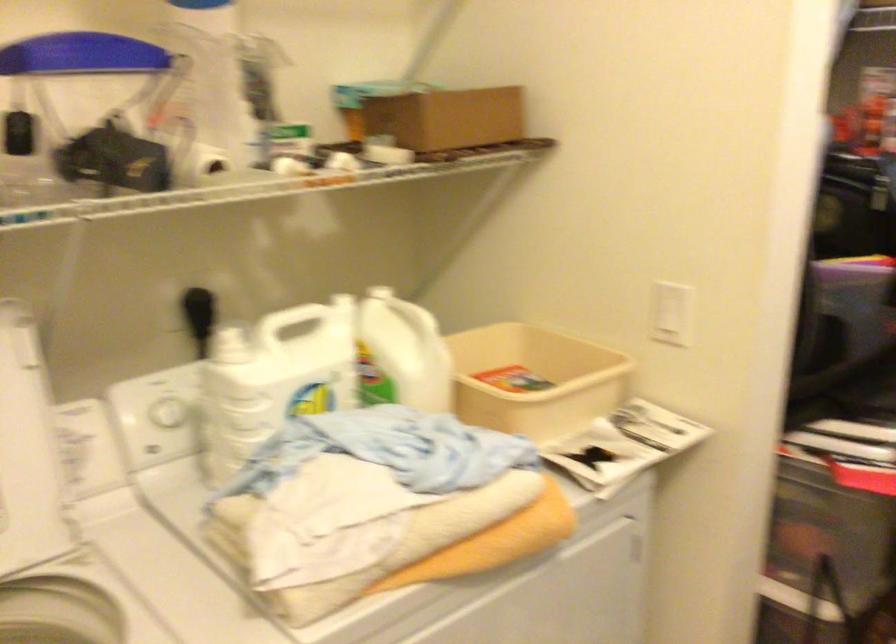
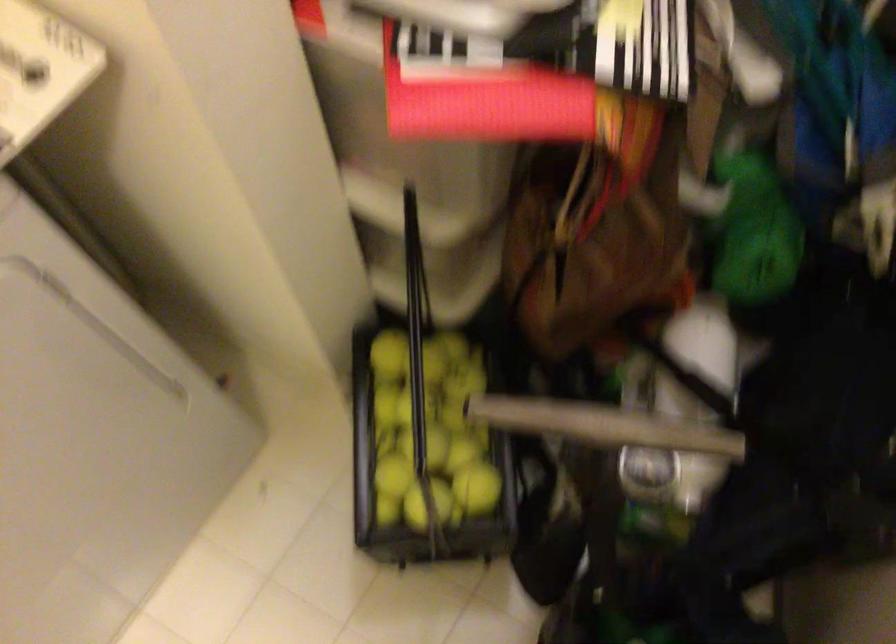
Question: Based on the continuous images, in which direction is the camera rotating? Reply with the corresponding letter.

Choices:
 (A) Left
 (B) Right
 (C) Up
 (D) Down

Answer: (D)